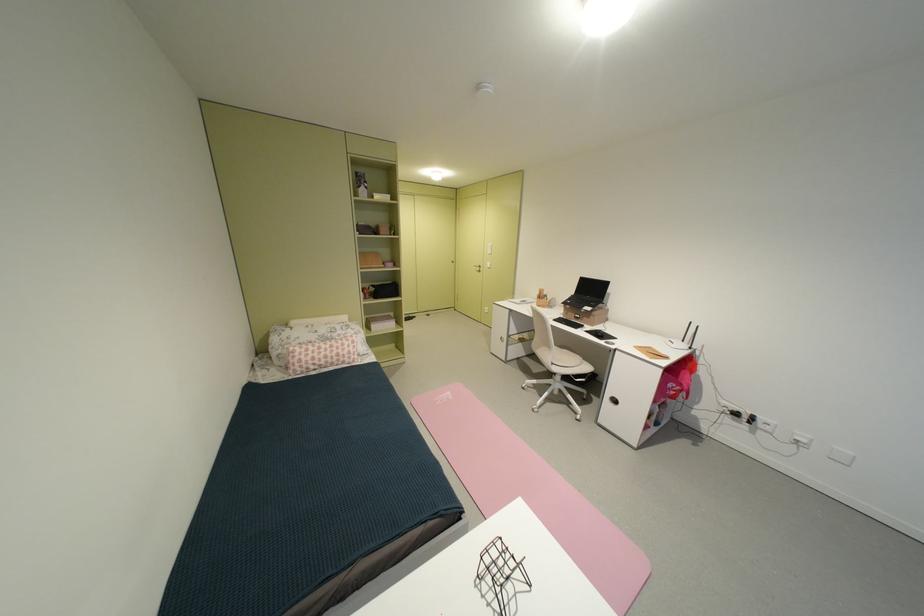
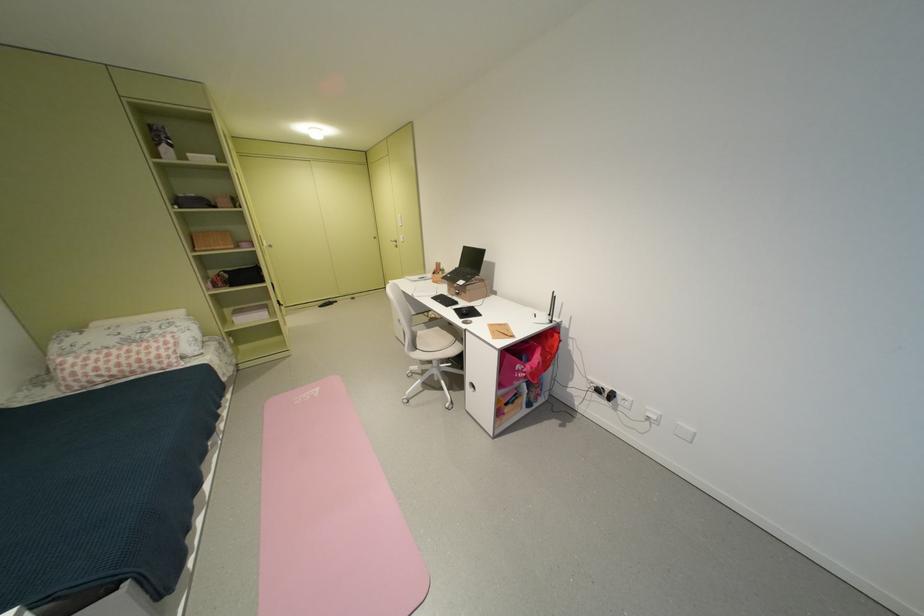
The point at (746, 416) is marked in the first image. Where is the corresponding point in the second image?

(609, 392)